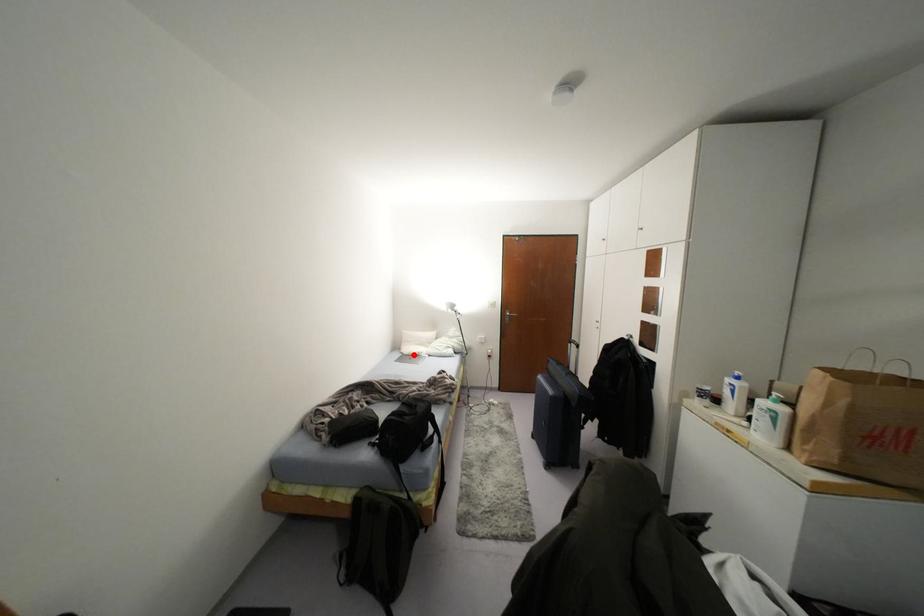
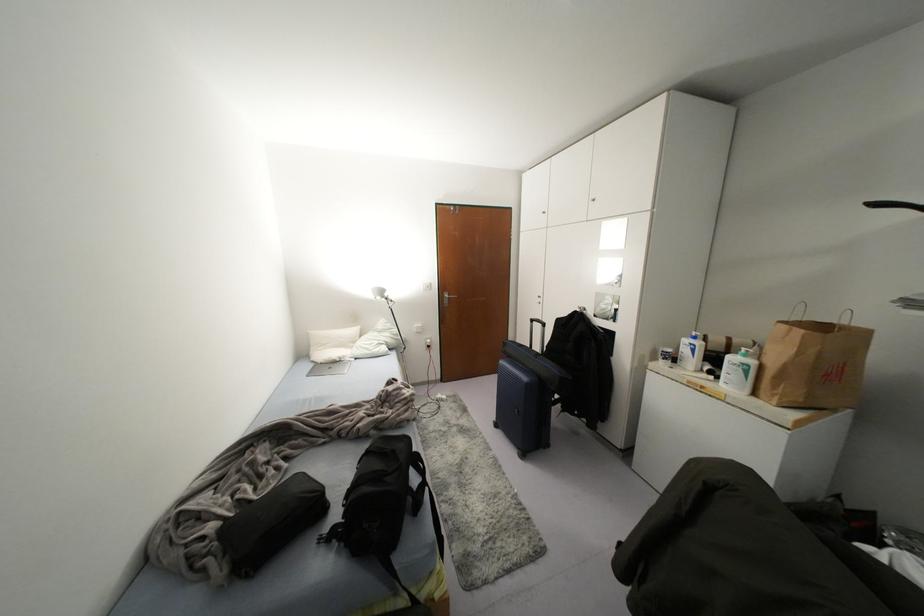
Where in the second image is the point corresponding to the highlighted location from the first image?

(334, 361)